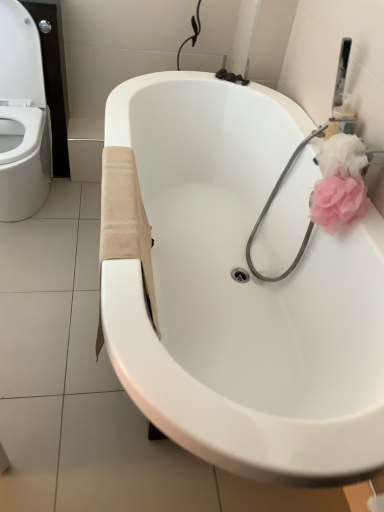
Question: Can you confirm if white glossy bathtub at center is taller than pink fabric rose at right?

Choices:
 (A) no
 (B) yes

Answer: (B)

Question: Does white glossy bathtub at center have a lesser width compared to pink fabric rose at right?

Choices:
 (A) no
 (B) yes

Answer: (A)

Question: Is white glossy bathtub at center located outside pink fabric rose at right?

Choices:
 (A) no
 (B) yes

Answer: (B)

Question: Is white glossy bathtub at center directly adjacent to pink fabric rose at right?

Choices:
 (A) no
 (B) yes

Answer: (A)

Question: Does white glossy bathtub at center contain pink fabric rose at right?

Choices:
 (A) yes
 (B) no

Answer: (A)

Question: Is white glossy bathtub at center smaller than pink fabric rose at right?

Choices:
 (A) yes
 (B) no

Answer: (B)

Question: From a real-world perspective, is pink fabric rose at right positioned under white glossy bathtub at center based on gravity?

Choices:
 (A) no
 (B) yes

Answer: (A)

Question: Considering the relative sizes of pink fabric rose at right and white glossy bathtub at center in the image provided, is pink fabric rose at right bigger than white glossy bathtub at center?

Choices:
 (A) no
 (B) yes

Answer: (A)

Question: Is white glossy bathtub at center located within pink fabric rose at right?

Choices:
 (A) yes
 (B) no

Answer: (B)

Question: Is pink fabric rose at right taller than white glossy bathtub at center?

Choices:
 (A) no
 (B) yes

Answer: (A)

Question: Are pink fabric rose at right and white glossy bathtub at center making contact?

Choices:
 (A) no
 (B) yes

Answer: (A)

Question: Would you say pink fabric rose at right is a long distance from white glossy bathtub at center?

Choices:
 (A) yes
 (B) no

Answer: (B)

Question: From the image's perspective, is white glossy bathtub at center above or below pink fabric rose at right?

Choices:
 (A) below
 (B) above

Answer: (A)